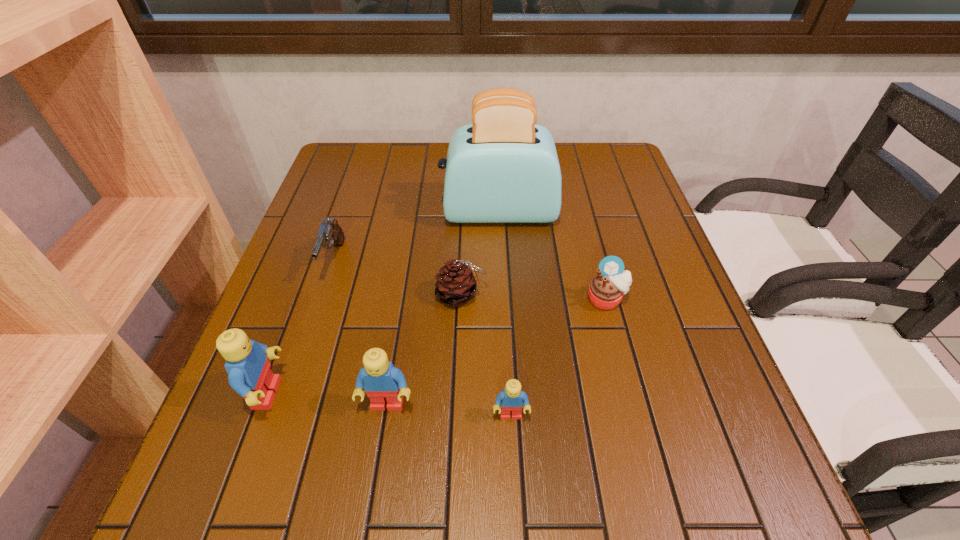
You are a GUI agent. You are given a task and a screenshot of the screen. Output one action in this format:
    pyautogui.click(x=<x>, y=<y>)
    Task: Click on the empty location between the muffin and the pinecone
    
    Given the screenshot: What is the action you would take?
    pyautogui.click(x=534, y=297)

The image size is (960, 540). What are the coordinates of `free spot between the second tallest Lego and the farthest object` in the screenshot? It's located at (443, 308).

I want to click on unoccupied position between the fifth shortest object and the pinecone, so click(x=424, y=349).

The width and height of the screenshot is (960, 540). Find the location of `free space between the tallest object and the rightmost Lego`. free space between the tallest object and the rightmost Lego is located at coordinates (505, 313).

Where is `vacant area between the leftmost Lego and the rightmost object`? vacant area between the leftmost Lego and the rightmost object is located at coordinates (437, 347).

At what (x,y) coordinates should I click in order to perform the action: click on vacant point located between the rightmost Lego and the toaster. Please return your answer as a coordinate pair (x, y). Image resolution: width=960 pixels, height=540 pixels. Looking at the image, I should click on (505, 313).

Locate which object is the fourth closest to the tallest object. Please provide its 2D coordinates. Your answer should be formatted as a tuple, i.e. [(x, y)], where the tuple contains the x and y coordinates of a point satisfying the conditions above.

[(382, 382)]

The image size is (960, 540). What are the coordinates of `object identified as the sixth closest to the fifth object from right to left` in the screenshot? It's located at (503, 168).

Find the location of a particular element. Lego that is the second closest to the farthest object is located at coordinates (249, 374).

The image size is (960, 540). What are the coordinates of `the closest Lego relative to the pistol` in the screenshot? It's located at (249, 374).